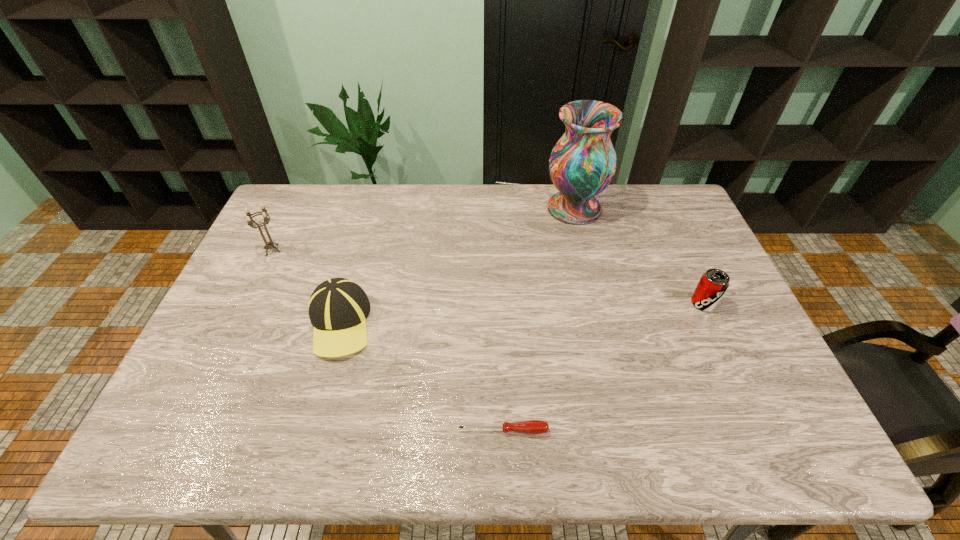
In the image, there is a desktop. Where is `vacant space at the far left corner`? This screenshot has width=960, height=540. vacant space at the far left corner is located at coordinates (277, 201).

In the image, there is a desktop. Where is `free space at the near left corner`? The width and height of the screenshot is (960, 540). free space at the near left corner is located at coordinates coord(183,441).

Locate an element on the screen. This screenshot has height=540, width=960. free region at the far right corner of the desktop is located at coordinates (684, 212).

You are a GUI agent. You are given a task and a screenshot of the screen. Output one action in this format:
    pyautogui.click(x=<x>, y=<y>)
    Task: Click on the blank region between the vase and the second object from left to right
    The width and height of the screenshot is (960, 540).
    Given the screenshot: What is the action you would take?
    pyautogui.click(x=457, y=266)

Where is `free spot between the shortest object and the second object from left to right`? free spot between the shortest object and the second object from left to right is located at coordinates (421, 377).

The image size is (960, 540). I want to click on empty space between the tallest object and the leftmost object, so click(x=423, y=229).

Locate an element on the screen. Image resolution: width=960 pixels, height=540 pixels. vacant area that lies between the rightmost object and the leftmost object is located at coordinates (488, 276).

You are a GUI agent. You are given a task and a screenshot of the screen. Output one action in this format:
    pyautogui.click(x=<x>, y=<y>)
    Task: Click on the empty space that is in between the third object from left to right and the leftmost object
    
    Given the screenshot: What is the action you would take?
    pyautogui.click(x=388, y=340)

The image size is (960, 540). Find the location of `empty location between the soda can and the vase`. empty location between the soda can and the vase is located at coordinates (638, 256).

Identify the location of vacant area between the rightmost object and the baseball cap. This screenshot has width=960, height=540. (521, 313).